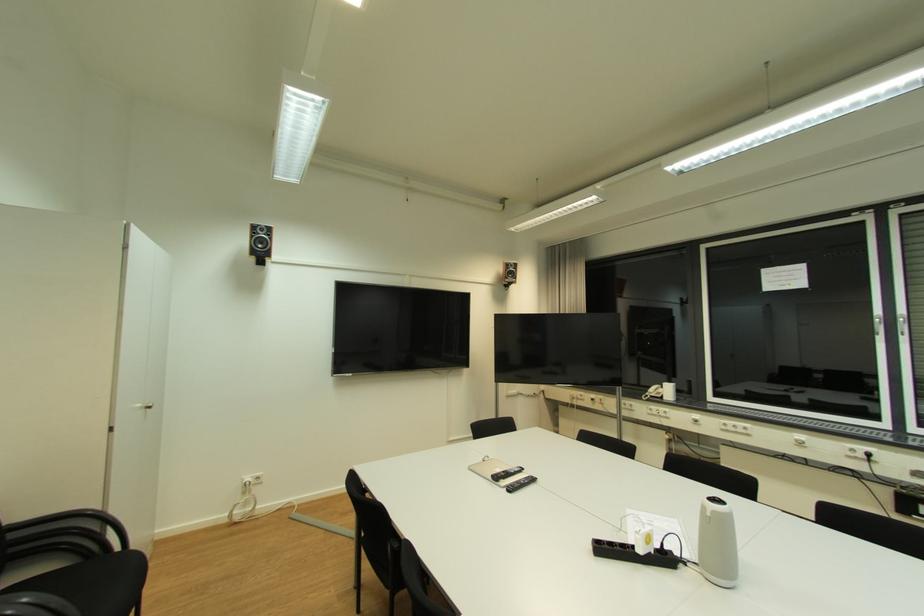
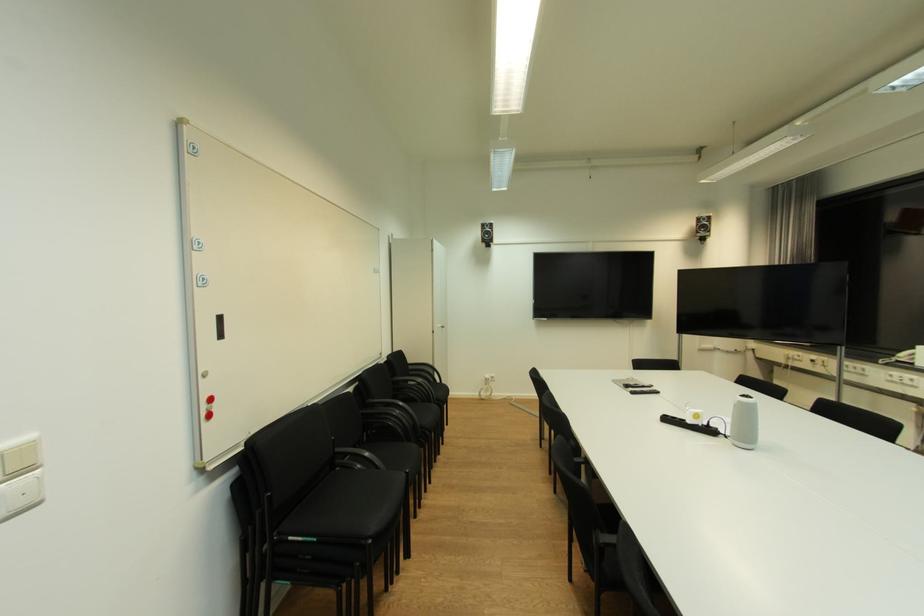
Locate, in the second image, the point that corresponds to (x=608, y=551) in the first image.

(674, 421)